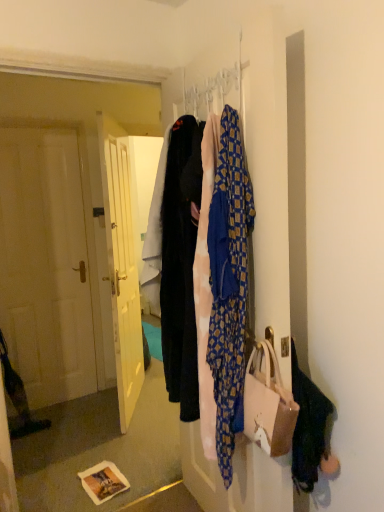
Question: Visually, is blue patterned fabric at center positioned to the left or to the right of metallic silver hanger at upper center?

Choices:
 (A) left
 (B) right

Answer: (B)

Question: Looking at their shapes, would you say blue patterned fabric at center is wider or thinner than metallic silver hanger at upper center?

Choices:
 (A) thin
 (B) wide

Answer: (B)

Question: Which object is positioned farthest from the blue patterned fabric at center?

Choices:
 (A) velvet black pants at center
 (B) metallic silver hanger at upper center

Answer: (B)

Question: Which is nearer to the velvet black pants at center?

Choices:
 (A) metallic silver hanger at upper center
 (B) blue patterned fabric at center

Answer: (B)